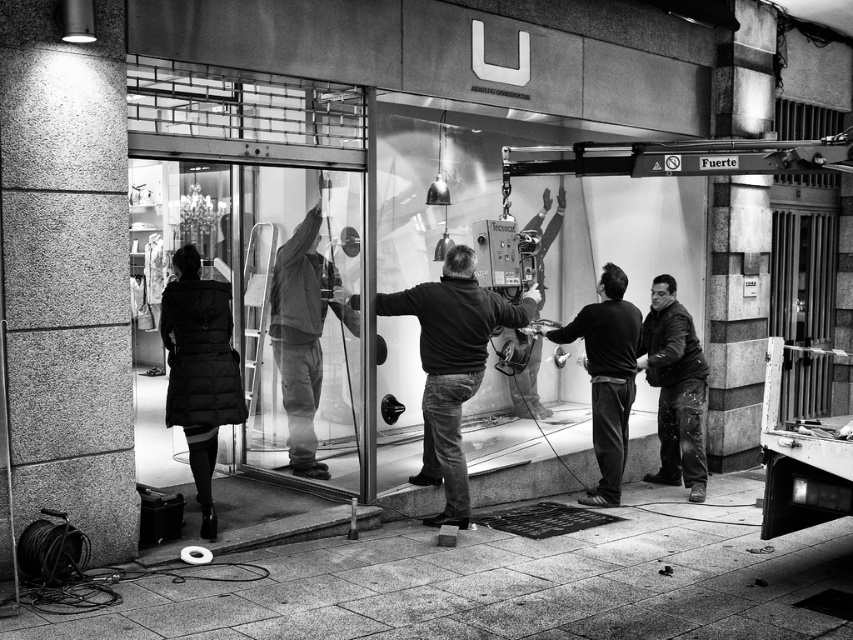
You are standing outside the storefront at night and want to enter through the transparent glass door at center. Based on the coordinates provided in the scene description, can you determine if the door is positioned centrally relative to the storefront?

The transparent glass door at center is located at point [302,328], which is very close to the center coordinates of the image, so yes, it is positioned centrally relative to the storefront.